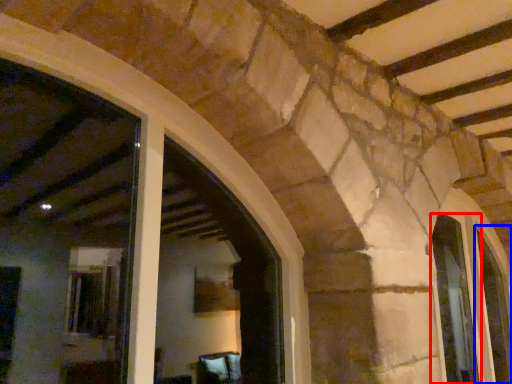
Question: Which object is closer to the camera taking this photo, window (highlighted by a red box) or window (highlighted by a blue box)?

Choices:
 (A) window
 (B) window

Answer: (A)